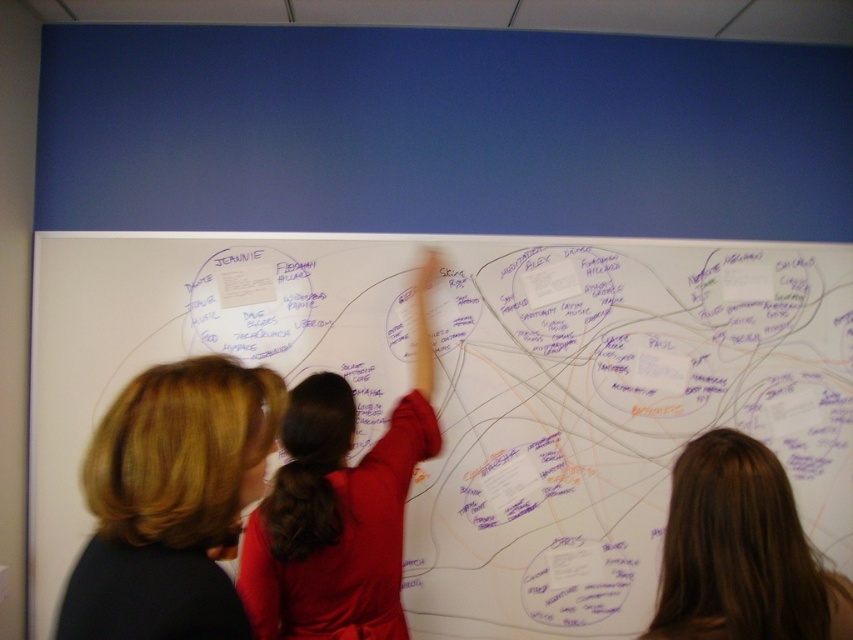
You are an interior designer assessing the space. The white matte whiteboard at center and the red fabric shirt at center are both in your line of sight. Which object occupies more visual space in the scene?

The white matte whiteboard at center has a larger size compared to the red fabric shirt at center, so it occupies more visual space in the scene.

You are a new team member joining a brainstorming session. You see the white matte whiteboard at center and the blonde hair at center. Which object is located higher up in the image?

The blonde hair at center is higher up in the image because the white matte whiteboard at center is positioned under it.